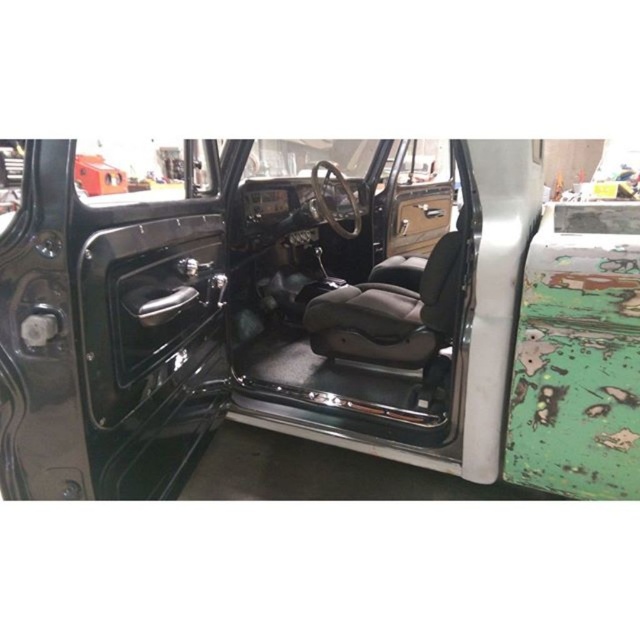
What do you see at coordinates (320, 321) in the screenshot?
I see `matte black seat at center` at bounding box center [320, 321].

Between point (116, 492) and point (387, 257), which one is positioned in front?

Point (116, 492) is more forward.

Find the location of a particular element. matte black seat at center is located at coordinates pos(320,321).